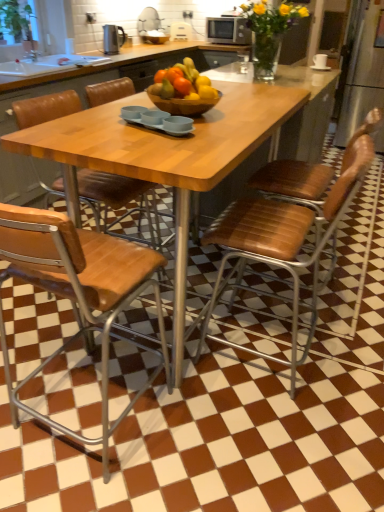
Question: Considering the positions of wooden table at center and wooden at center, positioned as the first chair in left-to-right order, in the image, is wooden table at center bigger or smaller than wooden at center, positioned as the first chair in left-to-right order,?

Choices:
 (A) big
 (B) small

Answer: (A)

Question: Is wooden table at center in front of or behind wooden at center, positioned as the first chair in left-to-right order, in the image?

Choices:
 (A) behind
 (B) front

Answer: (B)

Question: Which object is positioned farthest from the wooden bowl at center?

Choices:
 (A) wooden at center, which is the 4th chair from right to left
 (B) wooden table at center
 (C) brown leather chair at center, arranged as the 2th chair when viewed from the right
 (D) black plastic kettle at upper left, which is counted as the first appliance, starting from the left
 (E) brown leather chair at right, which ranks as the 4th chair in left-to-right order

Answer: (D)

Question: Which of these objects is positioned farthest from the brown leather chair at right, the 1th chair when ordered from right to left?

Choices:
 (A) wooden at center, which is the 4th chair from right to left
 (B) wooden at center, arranged as the third chair when viewed from the right
 (C) wooden bowl at center
 (D) wooden table at center
 (E) translucent glass vase at upper center

Answer: (E)